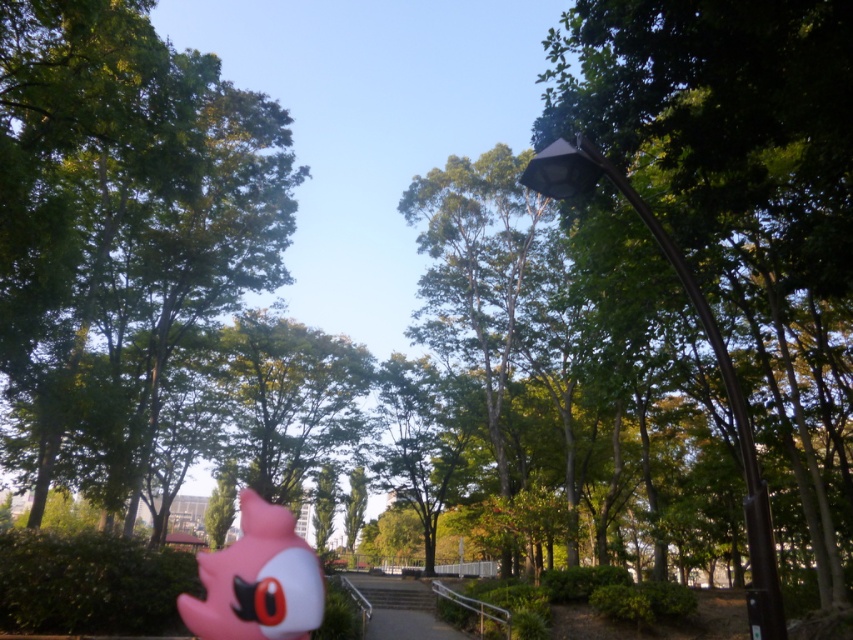
Question: Can you confirm if metallic gray streetlight at right is smaller than white concrete stairs at center?

Choices:
 (A) no
 (B) yes

Answer: (B)

Question: Can you confirm if green leafy tree at center is wider than metallic gray streetlight at right?

Choices:
 (A) yes
 (B) no

Answer: (A)

Question: Is pink matte plush toy at lower left to the left of white concrete stairs at center from the viewer's perspective?

Choices:
 (A) yes
 (B) no

Answer: (A)

Question: Estimate the real-world distances between objects in this image. Which object is farther from the pink matte plush toy at lower left?

Choices:
 (A) green leafy tree at center
 (B) white concrete stairs at center
 (C) metallic gray streetlight at right

Answer: (A)

Question: Which point appears closest to the camera in this image?

Choices:
 (A) (706, 312)
 (B) (200, 568)

Answer: (A)

Question: Which object is farther from the camera taking this photo?

Choices:
 (A) green leafy tree at center
 (B) pink matte plush toy at lower left
 (C) white concrete stairs at center

Answer: (C)